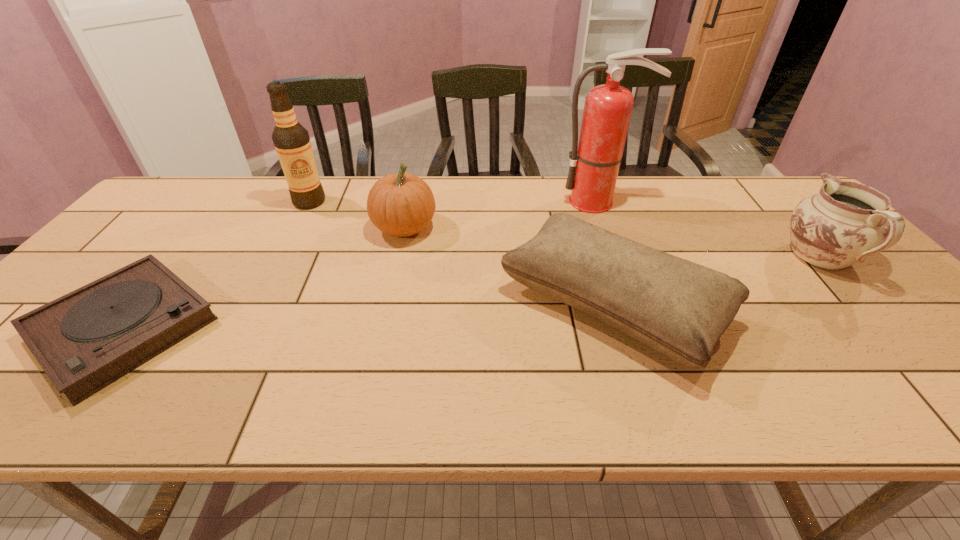
Find the location of a particular element. The height and width of the screenshot is (540, 960). vacant area that satisfies the following two spatial constraints: 1. with the handle and hose on the fire extinguisher; 2. on the stem of the fourth object from right to left is located at coordinates (607, 228).